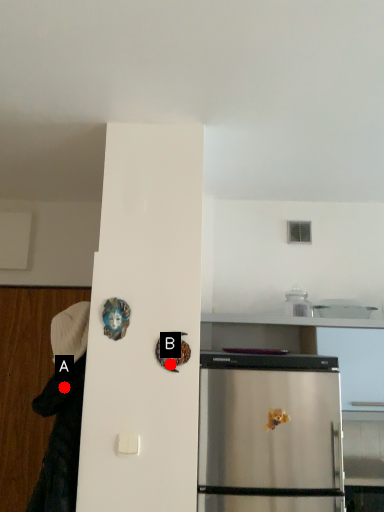
Question: Two points are circled on the image, labeled by A and B beside each circle. Which point appears closest to the camera in this image?

Choices:
 (A) A is closer
 (B) B is closer

Answer: (B)